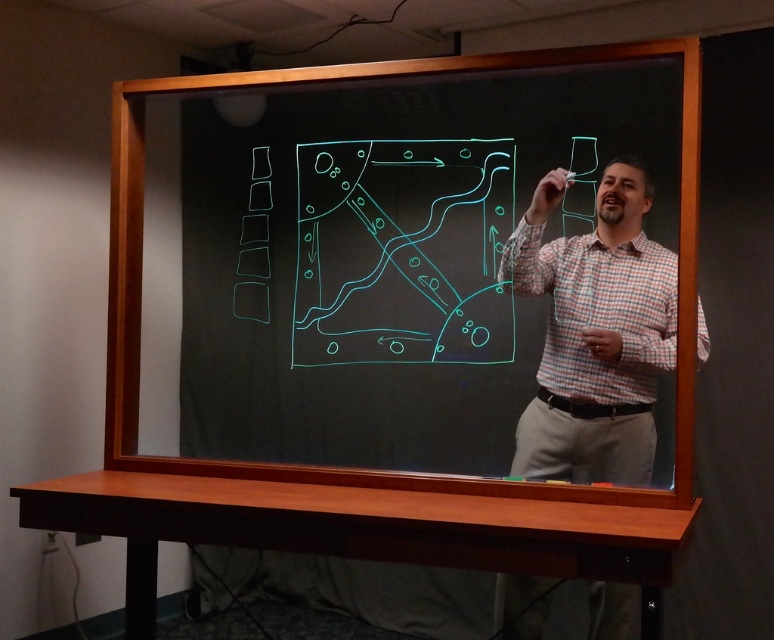
You are a student sitting in the front row of a classroom and see the blackboard at center and the plaid shirt at center. Which object is closer to you?

The blackboard at center is closer to you because it is further to the viewer than the plaid shirt at center.

You are an attendee at a presentation and see the blackboard at center and the plaid shirt at center. Which object takes up more space in the image?

The blackboard at center is larger in size than the plaid shirt at center, so it takes up more space in the image.